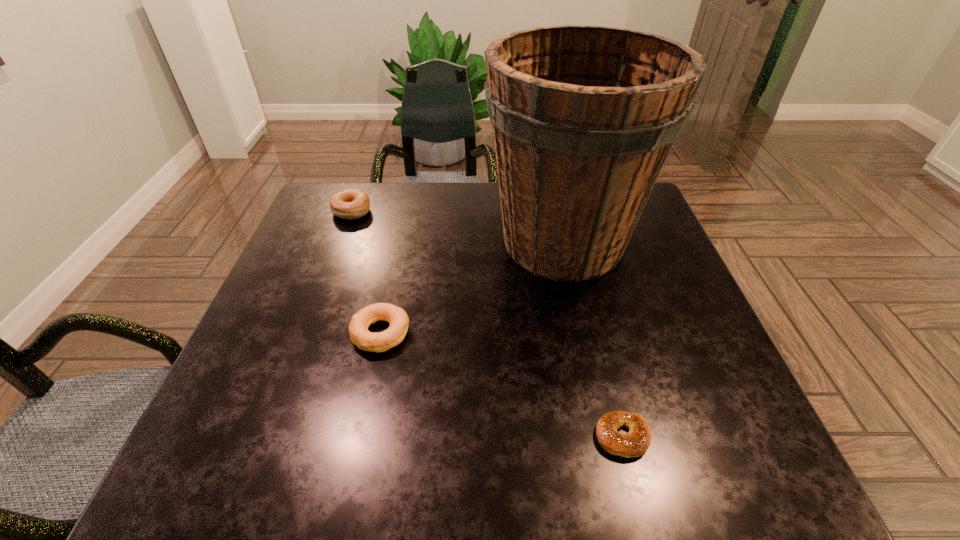
Find the location of a particular element. vacant space that satisfies the following two spatial constraints: 1. on the front side of the shortest object; 2. on the left side of the tallest bagel is located at coordinates (268, 437).